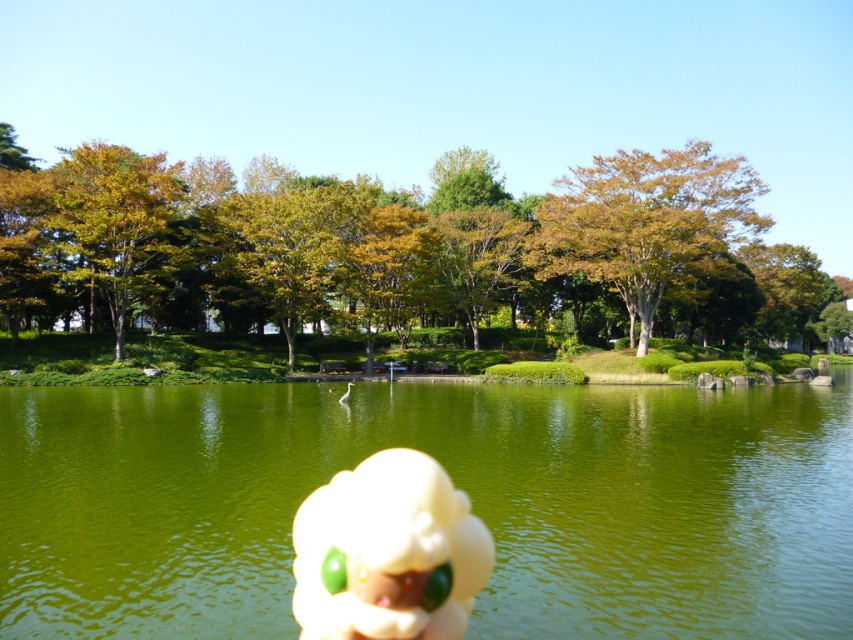
You are standing at the edge of the park pond and see the white plush toy at center. If you walk straight towards the center of the water, will you step on the toy?

The white plush toy at center is located at point [387,552], so if you walk straight towards the center of the water, you would need to adjust your path slightly to reach it since it is not exactly at the center point.